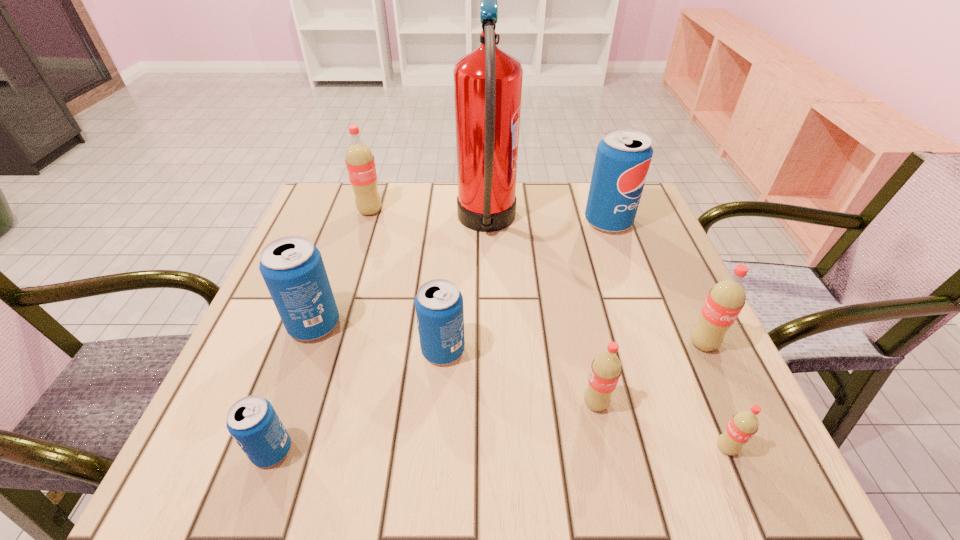
The image size is (960, 540). I want to click on red fire extinguisher, so click(488, 81).

Locate an element on the screen. This screenshot has width=960, height=540. the tallest object is located at coordinates (488, 81).

Locate an element on the screen. the rightmost blue soda can is located at coordinates (623, 156).

Locate an element on the screen. Image resolution: width=960 pixels, height=540 pixels. the biggest blue soda can is located at coordinates (623, 156).

This screenshot has width=960, height=540. I want to click on the leftmost red soda, so click(360, 163).

Locate an element on the screen. This screenshot has width=960, height=540. the biggest red soda is located at coordinates (360, 163).

Identify the location of the third smallest blue soda can. The image size is (960, 540). (292, 267).

I want to click on the second biggest red soda, so click(x=726, y=298).

This screenshot has height=540, width=960. Identify the location of the third blue soda can from left to right. (439, 310).

What are the coordinates of `the fifth soda from right to left` in the screenshot? It's located at (439, 310).